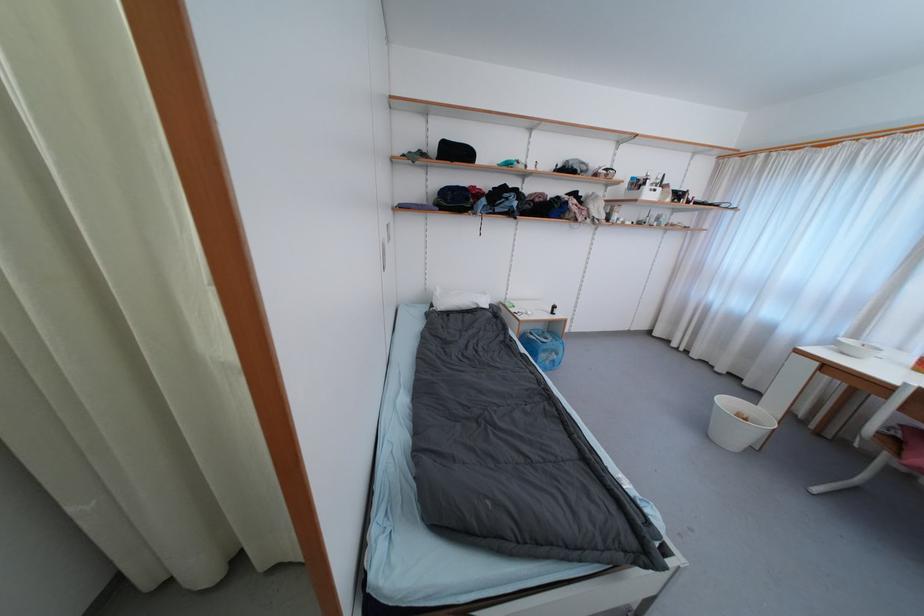
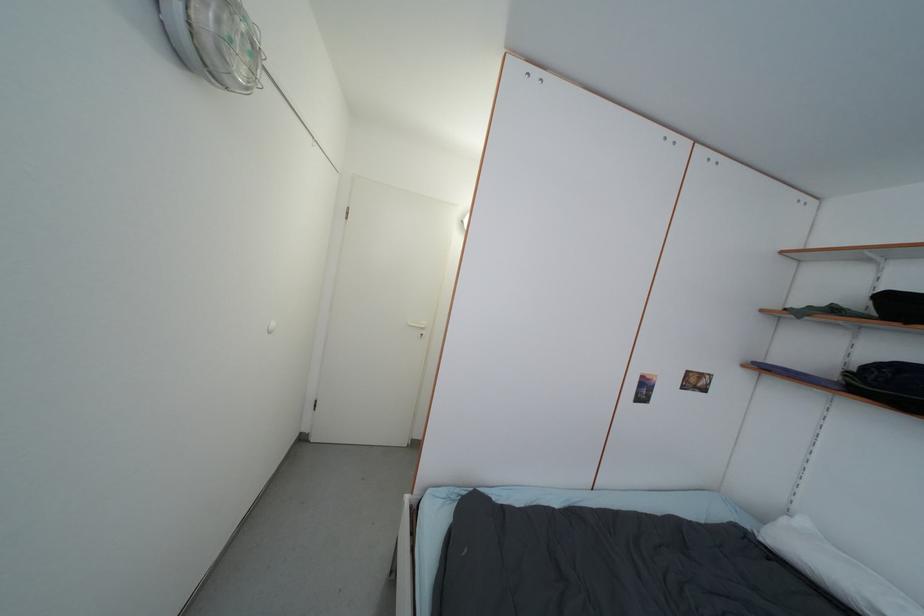
In the second image, find the point that corresponds to [459,310] in the first image.

(812, 576)